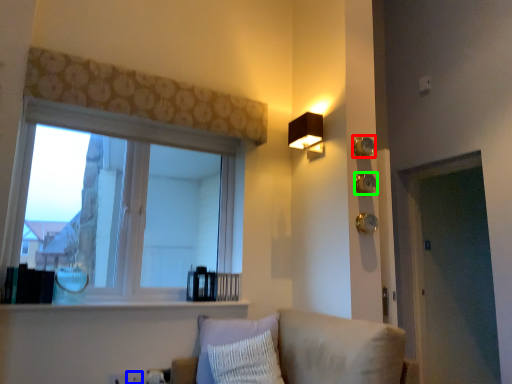
Question: Estimate the real-world distances between objects in this image. Which object is farther from knob (highlighted by a red box), electric outlet (highlighted by a blue box) or knob (highlighted by a green box)?

Choices:
 (A) electric outlet
 (B) knob

Answer: (A)